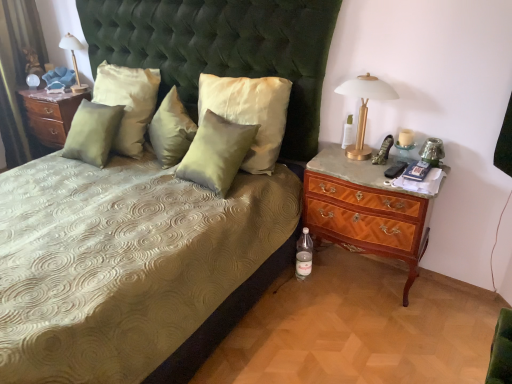
I want to click on free space to the left of mahogany wood nightstand at right, the first nightstand when ordered from bottom to top, so click(x=296, y=301).